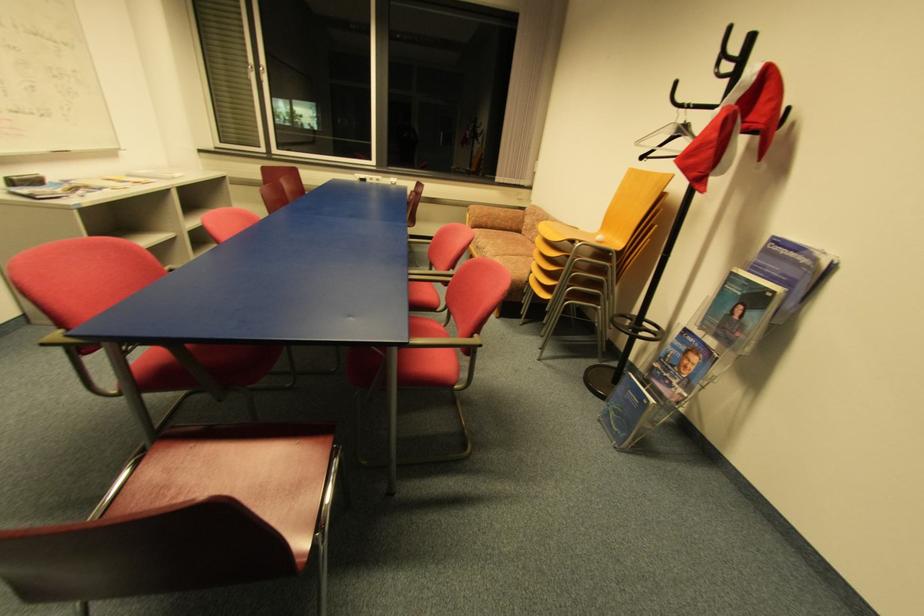
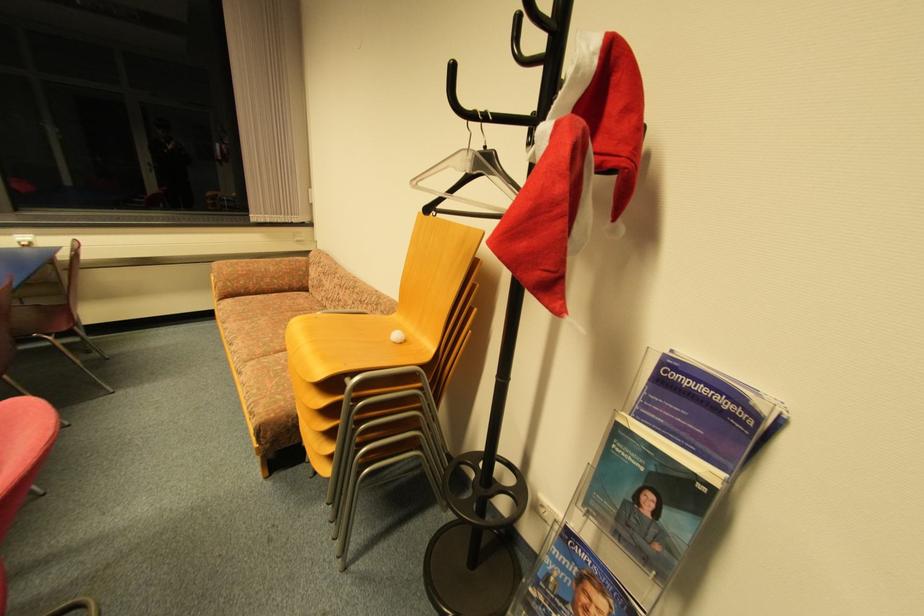
Locate, in the second image, the point that corresponds to the point at 694,108 in the first image.

(489, 119)